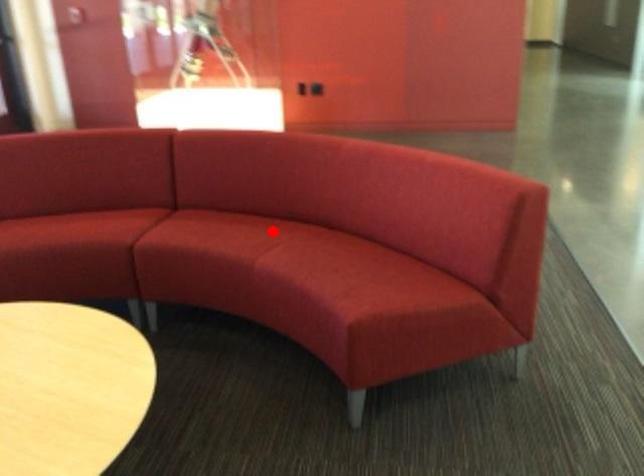
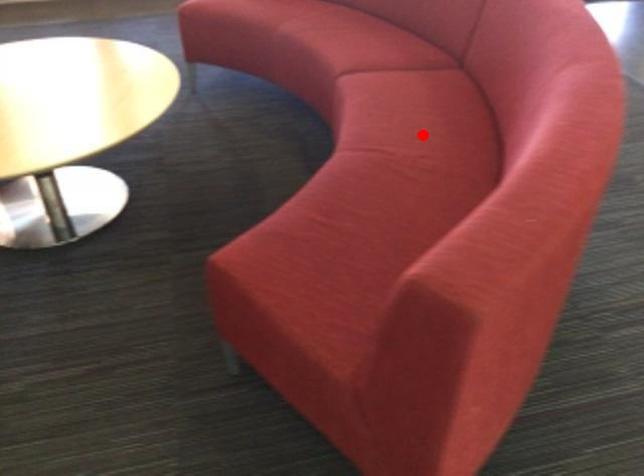
I am providing you with two images of the same scene from different viewpoints. A red point is marked on the first image and another point is marked on the second image. Is the red point in image1 aligned with the point shown in image2?

Yes